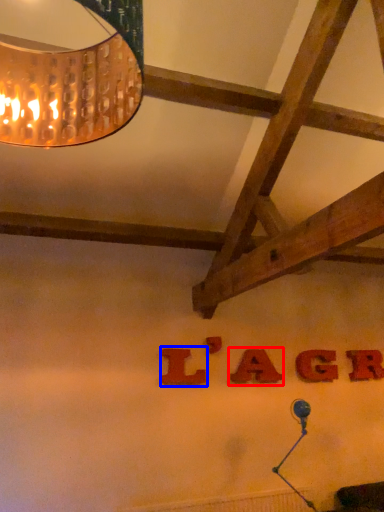
Question: Among these objects, which one is farthest to the camera, letter (highlighted by a red box) or letter (highlighted by a blue box)?

Choices:
 (A) letter
 (B) letter

Answer: (A)